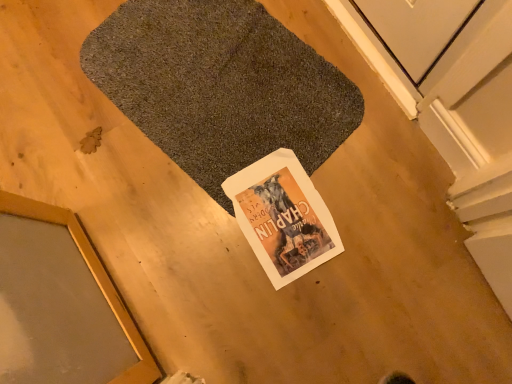
Question: Considering the relative sizes of white paper magazine at center and gold-framed mirror at lower left in the image provided, is white paper magazine at center smaller than gold-framed mirror at lower left?

Choices:
 (A) no
 (B) yes

Answer: (B)

Question: Is white paper magazine at center positioned with its back to gold-framed mirror at lower left?

Choices:
 (A) no
 (B) yes

Answer: (A)

Question: Can you confirm if white paper magazine at center is thinner than gold-framed mirror at lower left?

Choices:
 (A) no
 (B) yes

Answer: (B)

Question: Is white paper magazine at center taller than gold-framed mirror at lower left?

Choices:
 (A) yes
 (B) no

Answer: (B)

Question: Is white paper magazine at center at the left side of gold-framed mirror at lower left?

Choices:
 (A) no
 (B) yes

Answer: (A)

Question: Is the depth of white paper magazine at center less than that of gold-framed mirror at lower left?

Choices:
 (A) no
 (B) yes

Answer: (A)

Question: Is gold-framed mirror at lower left oriented towards white paper magazine at center?

Choices:
 (A) yes
 (B) no

Answer: (A)

Question: From the image's perspective, is gold-framed mirror at lower left below white paper magazine at center?

Choices:
 (A) yes
 (B) no

Answer: (A)

Question: Is gold-framed mirror at lower left surrounding white paper magazine at center?

Choices:
 (A) yes
 (B) no

Answer: (B)

Question: Is gold-framed mirror at lower left to the left of white paper magazine at center from the viewer's perspective?

Choices:
 (A) no
 (B) yes

Answer: (B)

Question: Can you confirm if gold-framed mirror at lower left is positioned to the right of white paper magazine at center?

Choices:
 (A) yes
 (B) no

Answer: (B)

Question: Is gold-framed mirror at lower left positioned before white paper magazine at center?

Choices:
 (A) yes
 (B) no

Answer: (A)

Question: Can you confirm if gold-framed mirror at lower left is thinner than dark gray carpet at center?

Choices:
 (A) no
 (B) yes

Answer: (B)